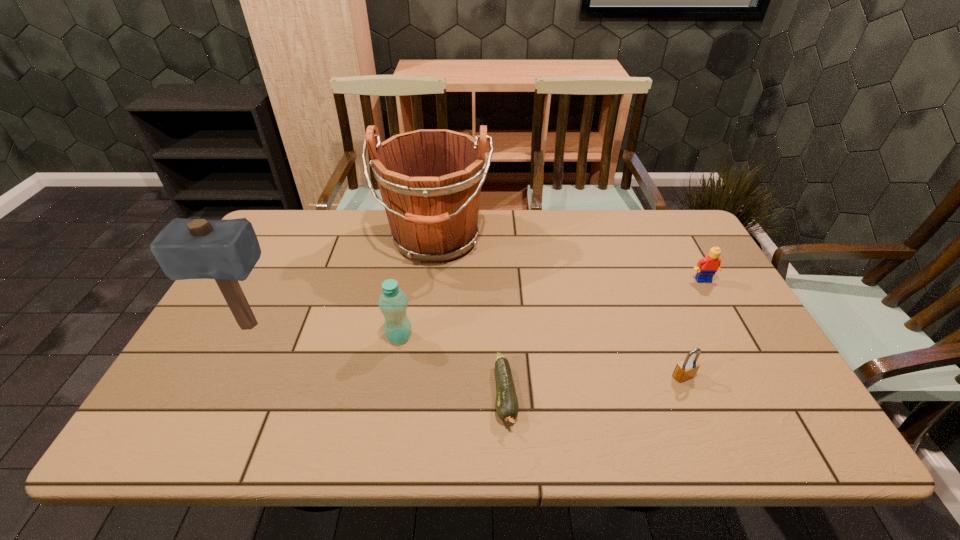
You are a GUI agent. You are given a task and a screenshot of the screen. Output one action in this format:
    pyautogui.click(x=<x>, y=<y>)
    Task: Click on the bucket
    Image resolution: width=960 pixels, height=540 pixels.
    Given the screenshot: What is the action you would take?
    pyautogui.click(x=430, y=180)

Locate an element on the screen. This screenshot has width=960, height=540. the leftmost object is located at coordinates (227, 250).

You are a GUI agent. You are given a task and a screenshot of the screen. Output one action in this format:
    pyautogui.click(x=<x>, y=<y>)
    Task: Click on the bottle
    The width and height of the screenshot is (960, 540).
    Given the screenshot: What is the action you would take?
    pyautogui.click(x=392, y=302)

The width and height of the screenshot is (960, 540). I want to click on Lego, so click(x=706, y=268).

Locate an element on the screen. This screenshot has height=540, width=960. the rightmost object is located at coordinates (706, 268).

Identify the location of padlock. This screenshot has width=960, height=540. (686, 369).

Find the location of a particular element. The height and width of the screenshot is (540, 960). the fifth object from left to right is located at coordinates (686, 369).

Locate an element on the screen. The height and width of the screenshot is (540, 960). the shortest object is located at coordinates (507, 407).

Find the location of a particular element. The height and width of the screenshot is (540, 960). vacant space positioned with the handle on the side of the bucket is located at coordinates (429, 290).

Locate an element on the screen. The height and width of the screenshot is (540, 960). free space located 0.100m on the back of the leftmost object is located at coordinates (269, 286).